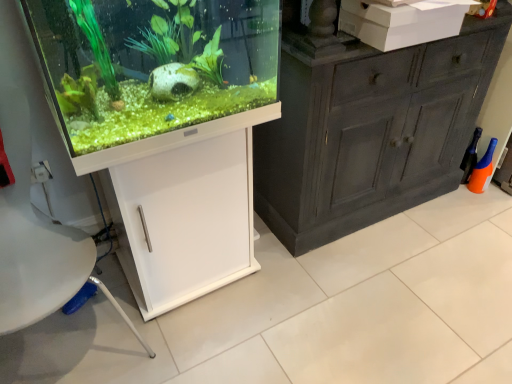
Describe the element at coordinates (184, 220) in the screenshot. The width and height of the screenshot is (512, 384). I see `white matte cabinet at lower left` at that location.

Identify the location of white matte cabinet at lower left. (184, 220).

What do you see at coordinates (402, 22) in the screenshot?
I see `white cardboard box at upper right` at bounding box center [402, 22].

Identify the location of white cardboard box at upper right. (402, 22).

The height and width of the screenshot is (384, 512). I want to click on white matte cabinet at lower left, so click(x=184, y=220).

Which is more to the right, white cardboard box at upper right or white matte cabinet at lower left?

white cardboard box at upper right is more to the right.

Which is behind, white cardboard box at upper right or white matte cabinet at lower left?

white cardboard box at upper right is further from the camera.

Considering the points (376, 43) and (161, 222), which point is behind, point (376, 43) or point (161, 222)?

The point (161, 222) is more distant.

From the image's perspective, is white cardboard box at upper right above or below white matte cabinet at lower left?

Based on their image positions, white cardboard box at upper right is located above white matte cabinet at lower left.

From a real-world perspective, is white cardboard box at upper right physically located above or below white matte cabinet at lower left?

In terms of real-world spatial position, white cardboard box at upper right is above white matte cabinet at lower left.

Considering the relative sizes of white cardboard box at upper right and white matte cabinet at lower left in the image provided, is white cardboard box at upper right thinner than white matte cabinet at lower left?

Correct, the width of white cardboard box at upper right is less than that of white matte cabinet at lower left.

Who is shorter, white cardboard box at upper right or white matte cabinet at lower left?

Standing shorter between the two is white cardboard box at upper right.

Considering the relative sizes of white cardboard box at upper right and white matte cabinet at lower left in the image provided, is white cardboard box at upper right bigger than white matte cabinet at lower left?

Actually, white cardboard box at upper right might be smaller than white matte cabinet at lower left.

Is white matte cabinet at lower left surrounded by white cardboard box at upper right?

No, white matte cabinet at lower left is not surrounded by white cardboard box at upper right.

Is white cardboard box at upper right positioned far away from white matte cabinet at lower left?

No, white cardboard box at upper right is not far away from white matte cabinet at lower left.

Is white cardboard box at upper right facing away from white matte cabinet at lower left?

No.

Can you tell me how much white cardboard box at upper right and white matte cabinet at lower left differ in facing direction?

white cardboard box at upper right and white matte cabinet at lower left are facing 0.717 degrees away from each other.

Image resolution: width=512 pixels, height=384 pixels. I want to click on cabinetry on the left of white cardboard box at upper right, so point(184,220).

Visually, is white matte cabinet at lower left positioned to the left or to the right of white cardboard box at upper right?

In the image, white matte cabinet at lower left appears on the left side of white cardboard box at upper right.

Which object is closer to the camera, white matte cabinet at lower left or white cardboard box at upper right?

white matte cabinet at lower left is in front.

Is point (144, 316) closer to viewer compared to point (410, 25)?

No, (144, 316) is behind (410, 25).

From the image's perspective, is white matte cabinet at lower left above or below white cardboard box at upper right?

Based on their image positions, white matte cabinet at lower left is located beneath white cardboard box at upper right.

From a real-world perspective, which object stands above the other?

white cardboard box at upper right, from a real-world perspective.

Which of these two, white matte cabinet at lower left or white cardboard box at upper right, is thinner?

With smaller width is white cardboard box at upper right.

Does white matte cabinet at lower left have a lesser height compared to white cardboard box at upper right?

In fact, white matte cabinet at lower left may be taller than white cardboard box at upper right.

Can you confirm if white matte cabinet at lower left is bigger than white cardboard box at upper right?

Yes, white matte cabinet at lower left is bigger than white cardboard box at upper right.

Choose the correct answer: Is white matte cabinet at lower left inside white cardboard box at upper right or outside it?

white matte cabinet at lower left exists outside the volume of white cardboard box at upper right.

Can you see white matte cabinet at lower left touching white cardboard box at upper right?

white matte cabinet at lower left and white cardboard box at upper right are not in contact.

Is white cardboard box at upper right at the back of white matte cabinet at lower left?

No, white matte cabinet at lower left is not facing the opposite direction of white cardboard box at upper right.

How distant is white matte cabinet at lower left from white cardboard box at upper right?

A distance of 29.23 inches exists between white matte cabinet at lower left and white cardboard box at upper right.

The height and width of the screenshot is (384, 512). Identify the location of box lying above the white matte cabinet at lower left (from the image's perspective). (402, 22).

Where is `cabinetry below the white cardboard box at upper right (from the image's perspective)`? This screenshot has width=512, height=384. cabinetry below the white cardboard box at upper right (from the image's perspective) is located at coordinates (184, 220).

The width and height of the screenshot is (512, 384). What are the coordinates of `box above the white matte cabinet at lower left (from a real-world perspective)` in the screenshot? It's located at click(402, 22).